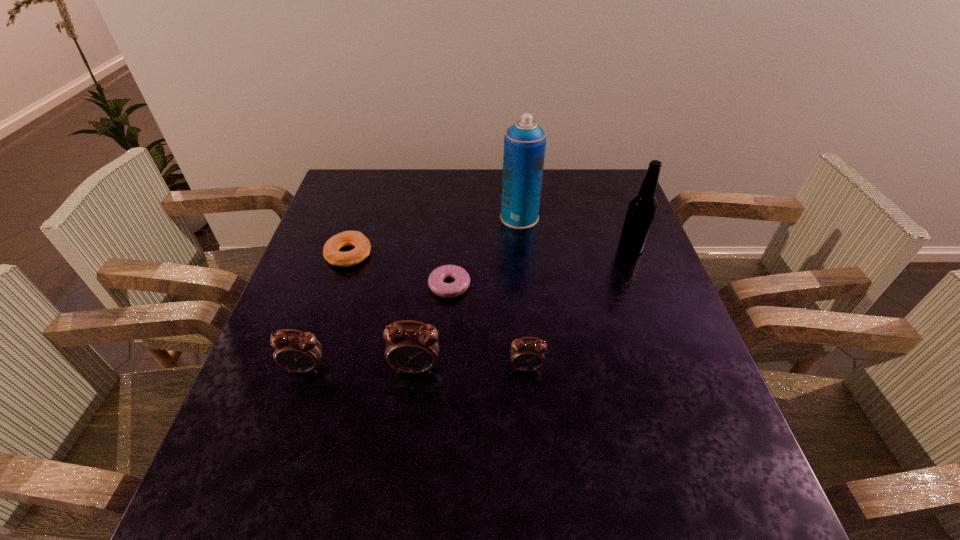
I want to click on the leftmost alarm clock, so click(x=301, y=352).

This screenshot has height=540, width=960. I want to click on the fourth tallest object, so [301, 352].

The width and height of the screenshot is (960, 540). I want to click on the second alarm clock from right to left, so click(x=412, y=349).

At what (x,y) coordinates should I click in order to perform the action: click on the fifth shortest object. Please return your answer as a coordinate pair (x, y). The width and height of the screenshot is (960, 540). Looking at the image, I should click on (412, 349).

I want to click on the rightmost alarm clock, so click(x=525, y=355).

Locate an element on the screen. the third shortest object is located at coordinates (525, 355).

Identify the location of the farthest object. (525, 141).

Where is `the tallest object`? The image size is (960, 540). the tallest object is located at coordinates (525, 141).

The image size is (960, 540). Identify the location of the sixth tallest object. (331, 252).

The width and height of the screenshot is (960, 540). What are the coordinates of `beer bottle` in the screenshot? It's located at 642,207.